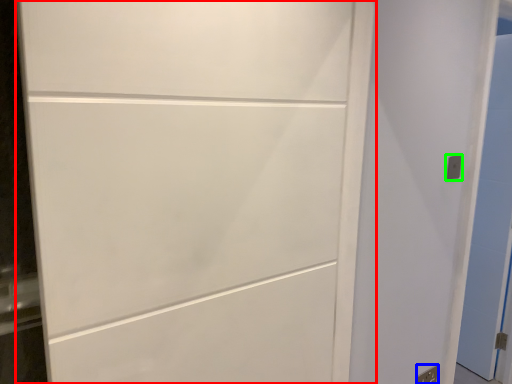
Question: Which object is the closest to the door (highlighted by a red box)? Choose among these: electric outlet (highlighted by a blue box) or electric outlet (highlighted by a green box).

Choices:
 (A) electric outlet
 (B) electric outlet

Answer: (B)